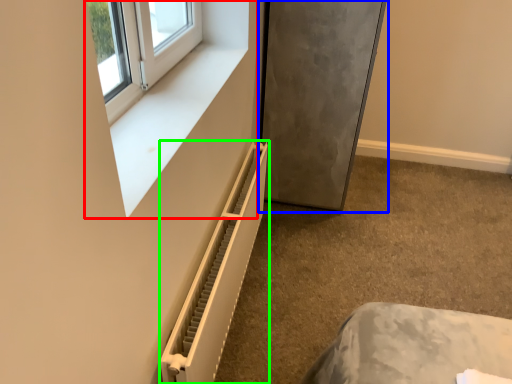
Question: Considering the real-world distances, which object is closest to window frame (highlighted by a red box)? fridge (highlighted by a blue box) or radiator (highlighted by a green box).

Choices:
 (A) fridge
 (B) radiator

Answer: (B)